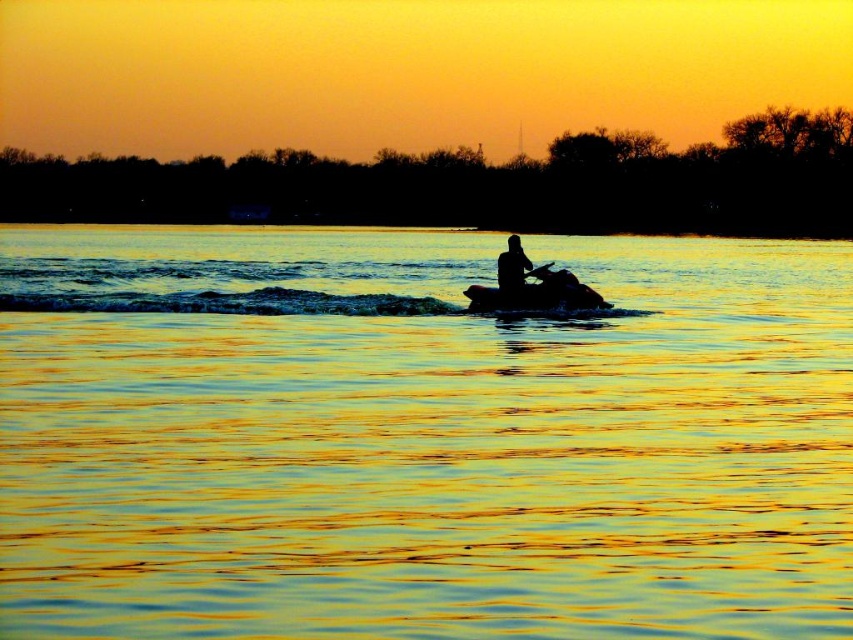
Between golden reflective water at center and silhouette jet ski at center, which one is positioned lower?

silhouette jet ski at center is lower down.

Does golden reflective water at center come in front of silhouette jet ski at center?

Yes.

Who is more forward, (750, 333) or (558, 301)?

Positioned in front is point (750, 333).

Where is `golden reflective water at center`? golden reflective water at center is located at coordinates (419, 436).

Where is `golden reflective water at center`? golden reflective water at center is located at coordinates (419, 436).

Is point (460, 298) positioned behind point (547, 268)?

Yes.

Who is more forward, (288, 598) or (548, 272)?

Positioned in front is point (288, 598).

Find the location of `golden reflective water at center`. golden reflective water at center is located at coordinates (419, 436).

You are a GUI agent. You are given a task and a screenshot of the screen. Output one action in this format:
    pyautogui.click(x=<x>, y=<y>)
    Task: Click on the black plastic paddle at center
    
    Given the screenshot: What is the action you would take?
    pyautogui.click(x=538, y=272)

Between black plastic paddle at center and black rubber paddle at center, which one has less height?

With less height is black rubber paddle at center.

Which is in front, point (511, 280) or point (535, 268)?

Point (535, 268)

The height and width of the screenshot is (640, 853). Find the location of `black plastic paddle at center`. black plastic paddle at center is located at coordinates (538, 272).